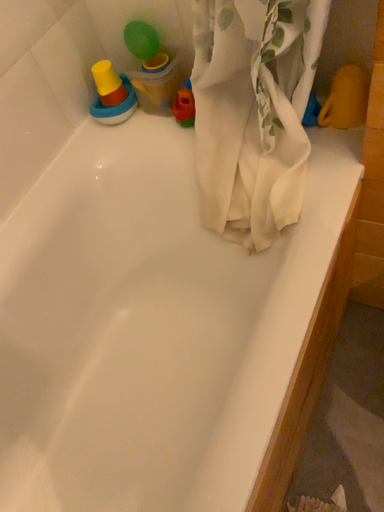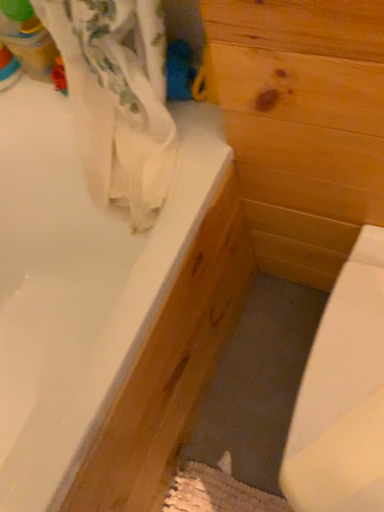
Question: How did the camera likely rotate when shooting the video?

Choices:
 (A) rotated downward
 (B) rotated upward

Answer: (A)